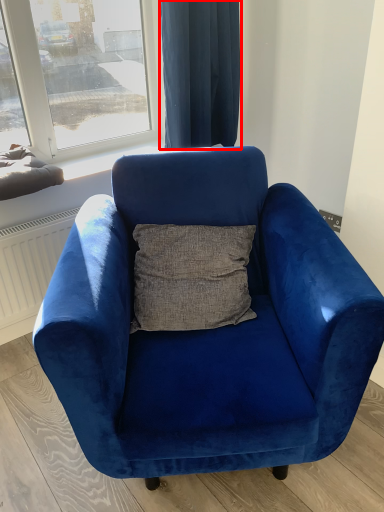
Question: Where is curtain (annotated by the red box) located in relation to chair in the image?

Choices:
 (A) left
 (B) right

Answer: (B)